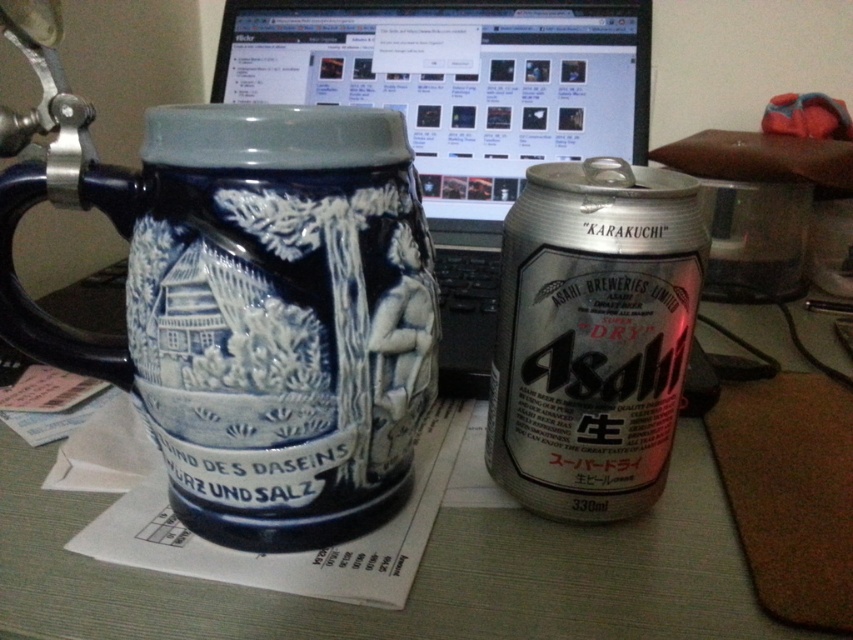
Between blue ceramic mug at left and silver metallic beer can at center, which one appears on the left side from the viewer's perspective?

From the viewer's perspective, blue ceramic mug at left appears more on the left side.

Which of these two, blue ceramic mug at left or silver metallic beer can at center, stands taller?

blue ceramic mug at left

Locate an element on the screen. blue ceramic mug at left is located at coordinates (260, 314).

Find the location of `blue ceramic mug at left`. blue ceramic mug at left is located at coordinates (260, 314).

Can you confirm if matte ceramic mug at center is thinner than silver metallic beer can at center?

No, matte ceramic mug at center is not thinner than silver metallic beer can at center.

Can you confirm if matte ceramic mug at center is taller than silver metallic beer can at center?

In fact, matte ceramic mug at center may be shorter than silver metallic beer can at center.

Is point (445, 333) positioned before point (508, 282)?

No, it is not.

The width and height of the screenshot is (853, 640). I want to click on matte ceramic mug at center, so click(416, 573).

Can you confirm if blue ceramic mug at left is thinner than matte ceramic mug at center?

Correct, blue ceramic mug at left's width is less than matte ceramic mug at center's.

Is blue ceramic mug at left to the left of matte ceramic mug at center from the viewer's perspective?

Indeed, blue ceramic mug at left is positioned on the left side of matte ceramic mug at center.

Image resolution: width=853 pixels, height=640 pixels. Find the location of `blue ceramic mug at left`. blue ceramic mug at left is located at coordinates (260, 314).